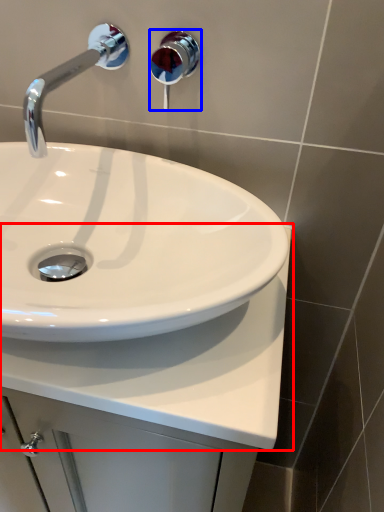
Question: Which object is further to the camera taking this photo, counter top (highlighted by a red box) or shower (highlighted by a blue box)?

Choices:
 (A) counter top
 (B) shower

Answer: (B)